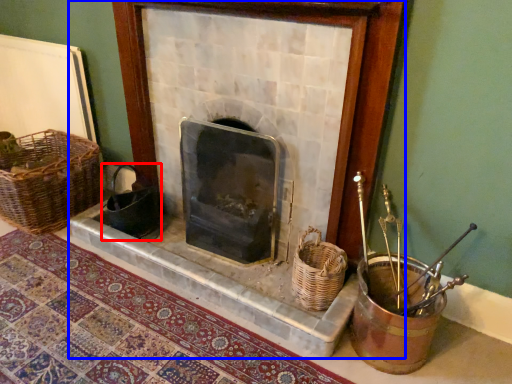
Question: Which object is closer to the camera taking this photo, gift basket (highlighted by a red box) or fireplace (highlighted by a blue box)?

Choices:
 (A) gift basket
 (B) fireplace

Answer: (B)